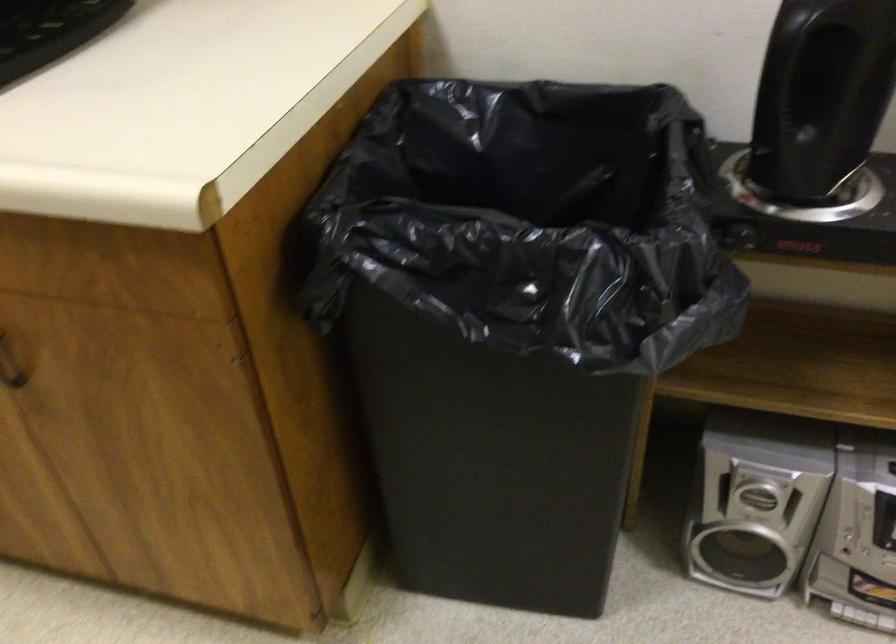
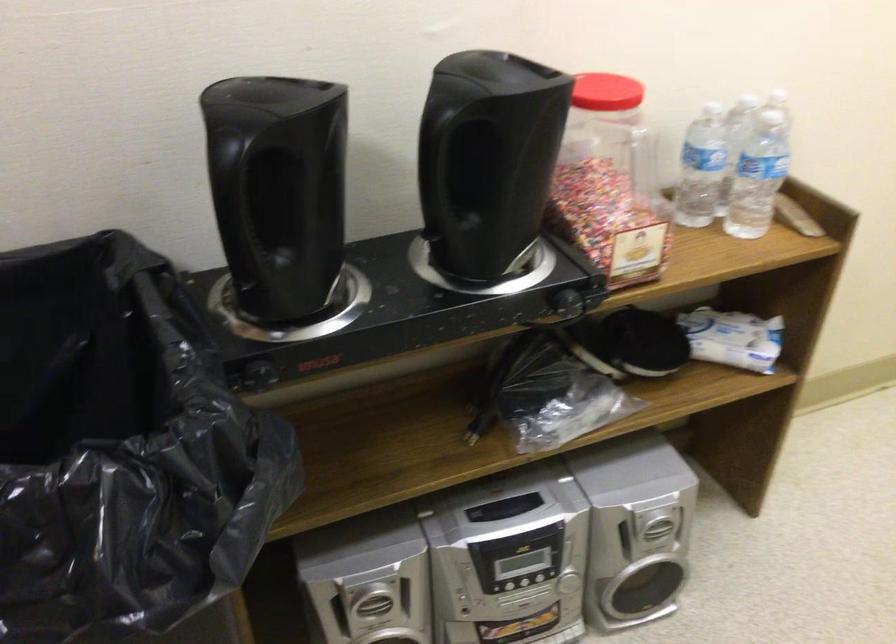
In the second image, find the point that corresponds to [755,491] in the first image.

(373, 603)